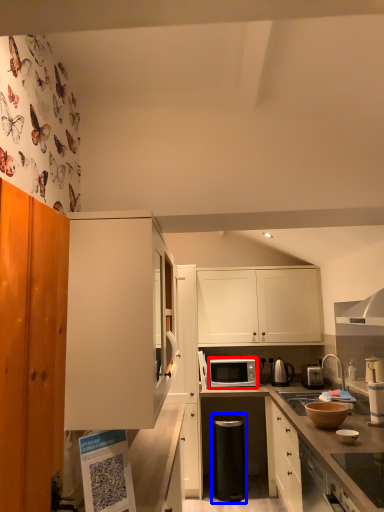
Question: Among these objects, which one is farthest to the camera, microwave oven (highlighted by a red box) or appliance (highlighted by a blue box)?

Choices:
 (A) microwave oven
 (B) appliance

Answer: (A)